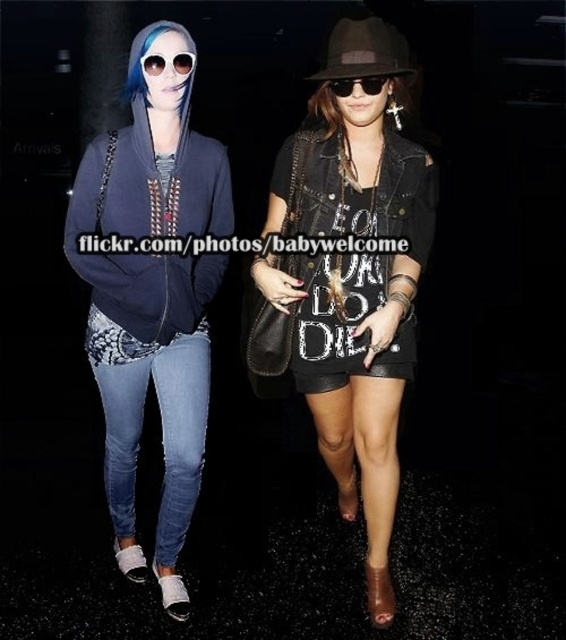
Question: Does leather shorts at center appear on the left side of dark brown felt fedora at upper center?

Choices:
 (A) no
 (B) yes

Answer: (B)

Question: Based on their relative distances, which object is farther from the blue denim jeans at lower left?

Choices:
 (A) black matte sunglasses at upper center
 (B) black leather dress at center
 (C) leather shorts at center
 (D) matte blue hoodie at left

Answer: (A)

Question: Considering the relative positions of black leather dress at center and black matte sunglasses at upper center in the image provided, where is black leather dress at center located with respect to black matte sunglasses at upper center?

Choices:
 (A) left
 (B) right

Answer: (B)

Question: Can you confirm if black leather dress at center is positioned to the left of brown textured hair at center?

Choices:
 (A) no
 (B) yes

Answer: (B)

Question: Based on their relative distances, which object is nearer to the leather shorts at center?

Choices:
 (A) black matte sunglasses at upper center
 (B) white reflective goggles at upper left
 (C) matte blue hoodie at left
 (D) blue denim jeans at lower left

Answer: (C)

Question: Which point is farther to the camera?

Choices:
 (A) (190, 358)
 (B) (372, 90)
 (C) (349, 88)
 (D) (173, 81)

Answer: (A)